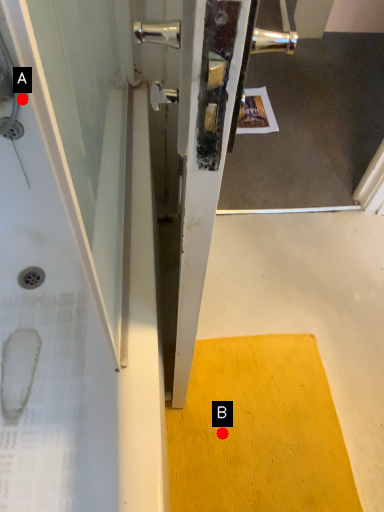
Question: Two points are circled on the image, labeled by A and B beside each circle. Which of the following is the farthest from the observer?

Choices:
 (A) A is further
 (B) B is further

Answer: (B)